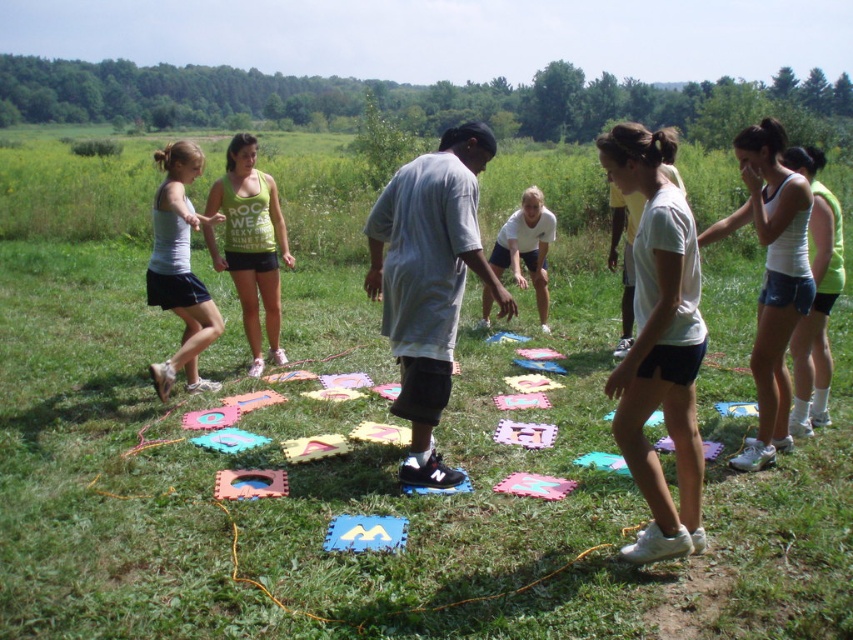
You are organizing a group activity and need to ensure that all clothing items are visible to participants. Considering the white matte shorts at center and the matte gray tank top at left, which clothing item takes up more space and might be easier to spot from a distance?

The matte gray tank top at left occupies more space than the white matte shorts at center, so it would be easier to spot from a distance.

You are a photographer trying to capture a candid shot of the white matte shorts at center and the white matte tank top at upper right. From the perspective of someone standing behind the photographer, which object is more to the left?

The white matte shorts at center is positioned on the left side of white matte tank top at upper right, so from the photographer perspective, the white matte shorts at center is more to the left.